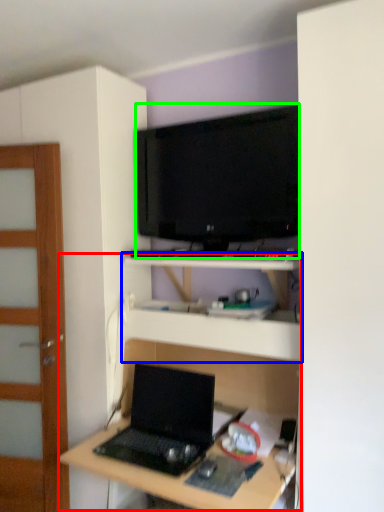
Question: Which object is positioned farthest from computer desk (highlighted by a red box)? Select from shelf (highlighted by a blue box) and television (highlighted by a green box).

Choices:
 (A) shelf
 (B) television

Answer: (B)